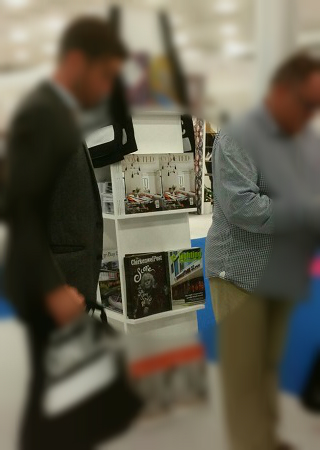
In order to click on two of the same books side by side in this screenshot , I will do `click(152, 189)`, `click(183, 196)`.